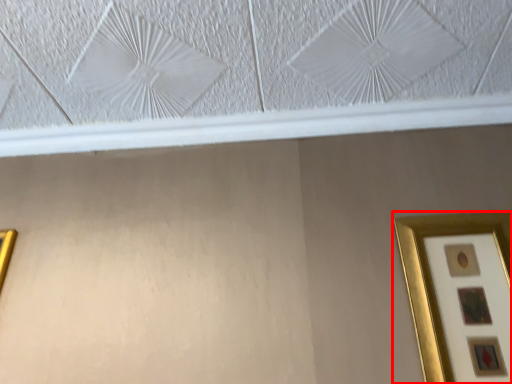
Question: Observing the image, what is the correct spatial positioning of picture frame (annotated by the red box) in reference to picture frame?

Choices:
 (A) right
 (B) left

Answer: (A)